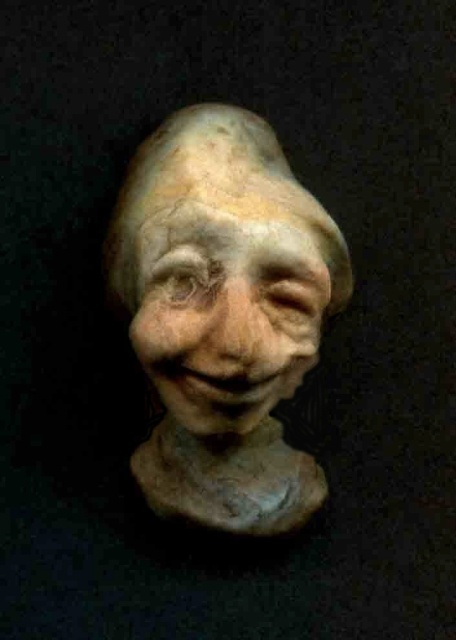
Is matte clay sculpture at center closer to the viewer compared to matte clay face at center?

No, it is behind matte clay face at center.

Can you confirm if matte clay sculpture at center is shorter than matte clay face at center?

In fact, matte clay sculpture at center may be taller than matte clay face at center.

At what (x,y) coordinates should I click in order to perform the action: click on matte clay sculpture at center. Please return your answer as a coordinate pair (x, y). This screenshot has width=456, height=640. Looking at the image, I should click on (223, 314).

This screenshot has height=640, width=456. Identify the location of matte clay sculpture at center. (223, 314).